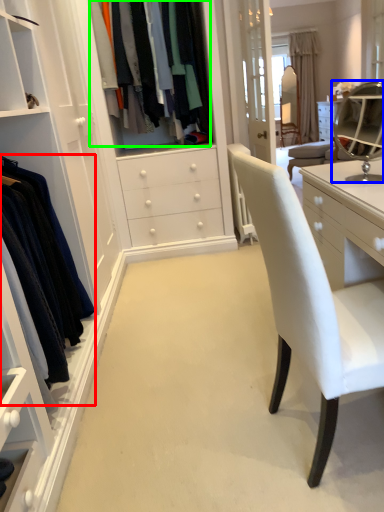
Question: Estimate the real-world distances between objects in this image. Which object is closer to clothing (highlighted by a red box), mirror (highlighted by a blue box) or clothing (highlighted by a green box)?

Choices:
 (A) mirror
 (B) clothing

Answer: (B)